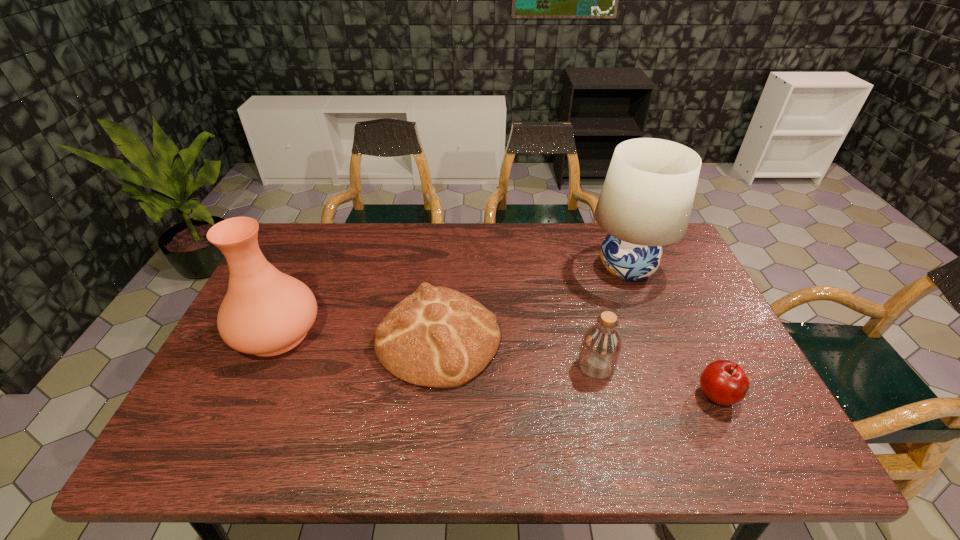
The height and width of the screenshot is (540, 960). I want to click on vacant point that satisfies the following two spatial constraints: 1. on the front-facing side of the apple; 2. on the left side of the lampshade, so click(x=676, y=395).

I want to click on free space that satisfies the following two spatial constraints: 1. on the front-facing side of the lampshade; 2. on the left side of the apple, so click(x=676, y=395).

Locate an element on the screen. This screenshot has width=960, height=540. free region that satisfies the following two spatial constraints: 1. on the front-facing side of the lampshade; 2. on the back side of the apple is located at coordinates (676, 395).